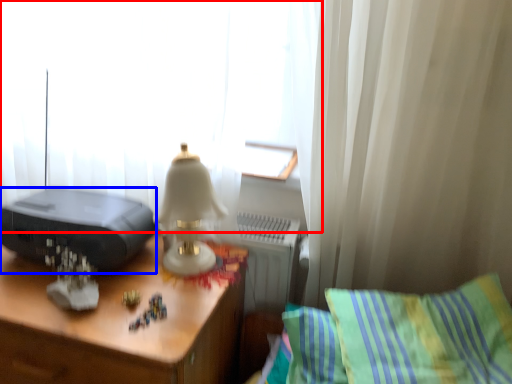
Question: Among these objects, which one is nearest to the camera, curtain (highlighted by a red box) or printer (highlighted by a blue box)?

Choices:
 (A) curtain
 (B) printer

Answer: (A)